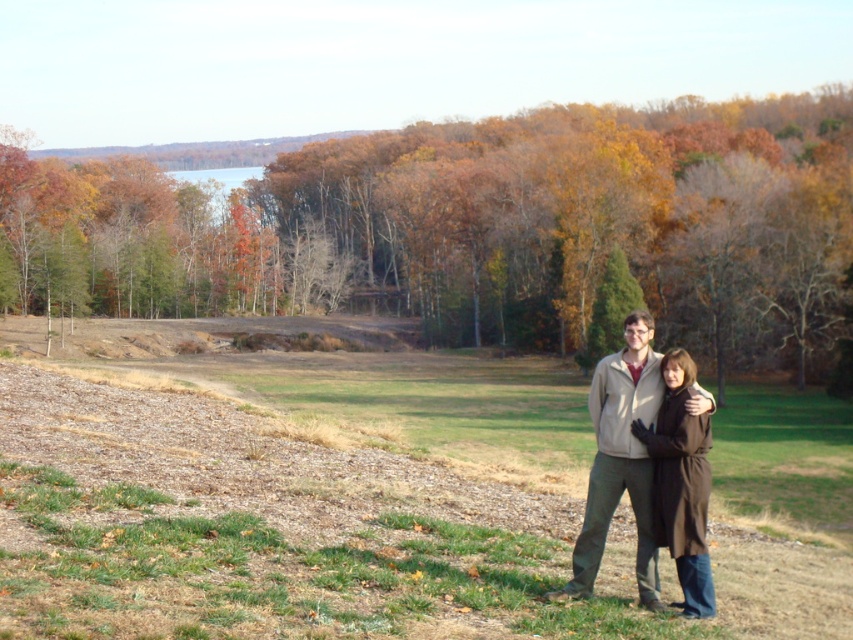
You are standing at the point marked by the coordinates (482, 228) in the image. What object are you standing on?

You are standing on the brown matte tree at center.

You are a photographer setting up a shot of the two people in the beige fleece jacket at center and the brown wool coat at lower right. You want to ensure they are positioned close enough to appear connected in the photo. The minimum distance for this effect is 1.2 meters. Is their current distance sufficient?

The beige fleece jacket at center and brown wool coat at lower right are 1.28 meters apart, which is just above the 1.2 meter minimum requirement. Their current distance is sufficient to appear connected in the photo.

You are planning to take a photo of the beige fleece jacket at center and the brown matte tree at center. Which object should be placed closer to the camera to ensure both are in focus?

The beige fleece jacket at center should be placed closer to the camera because it is narrower than the brown matte tree at center, allowing both to fit within the frame and maintain focus.